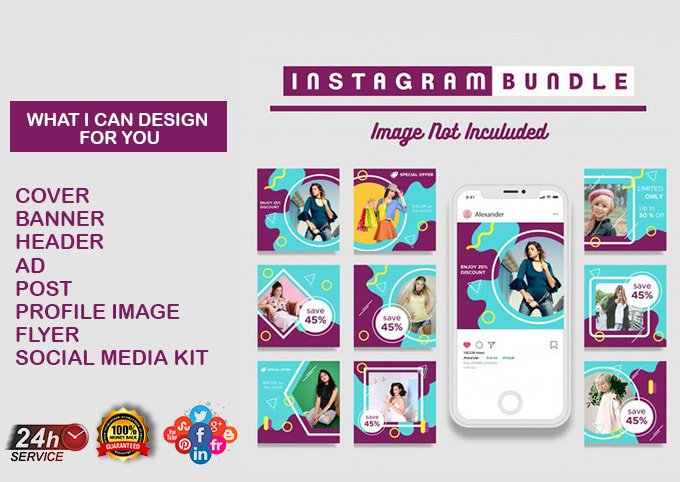
Identify the location of phone. (449, 406).